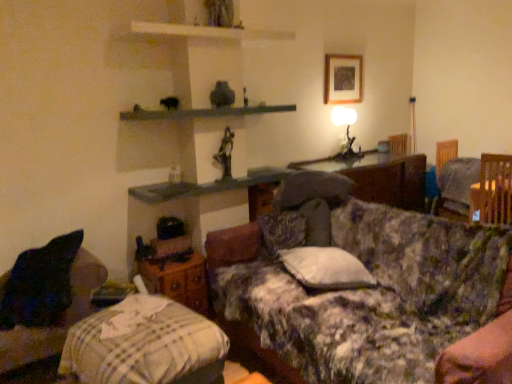
Question: Considering their positions, is wooden swivel chair at right located in front of or behind metallic statue at upper center?

Choices:
 (A) front
 (B) behind

Answer: (B)

Question: Is wooden swivel chair at right bigger or smaller than metallic statue at upper center?

Choices:
 (A) small
 (B) big

Answer: (B)

Question: Estimate the real-world distances between objects in this image. Which object is farther from the metallic bronze table lamp at upper right?

Choices:
 (A) floral fabric couch at center
 (B) smooth gray stone mantle at upper center
 (C) striped cotton blanket at lower left
 (D) metallic statue at upper center
 (E) wooden picture frame at upper center

Answer: (C)

Question: Which object is positioned farthest from the wooden swivel chair at right?

Choices:
 (A) metallic bronze table lamp at upper right
 (B) wooden picture frame at upper center
 (C) wooden at left
 (D) striped cotton blanket at lower left
 (E) floral fabric couch at center

Answer: (D)